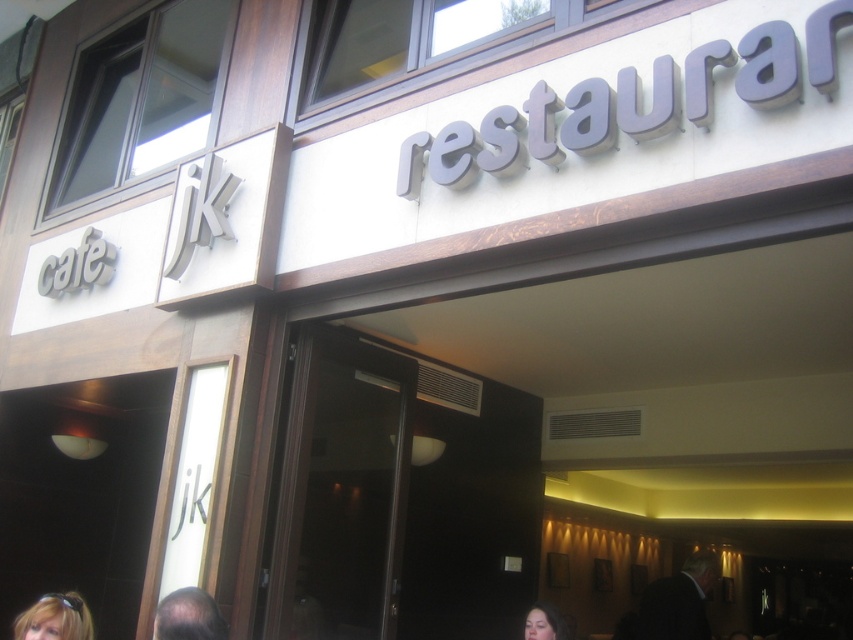
You are a customer waiting outside the cafe and want to look at the menu displayed on the window. There is a blonde hair at lower left and a smooth skin face at lower center in your way. Which object should you move to get a clear view of the menu?

You should move the smooth skin face at lower center since it is behind the blonde hair at lower left, so moving the face would allow you to see through the window without obstruction.

You are standing outside the Cafe JK entrance and notice a person with blonde hair at lower left. Can you determine if this person is facing towards the entrance or away from it based on their position?

The blonde hair at lower left is located at point (55, 618), which is near the lower left corner of the image. This suggests the person is facing away from the entrance, as their back is likely towards the entrance area.

You are standing outside the entrance of Cafe JK. There is a point marked at coordinates (55, 618). What object or feature is located at this point?

The point at coordinates (55, 618) corresponds to the blonde hair at lower left.